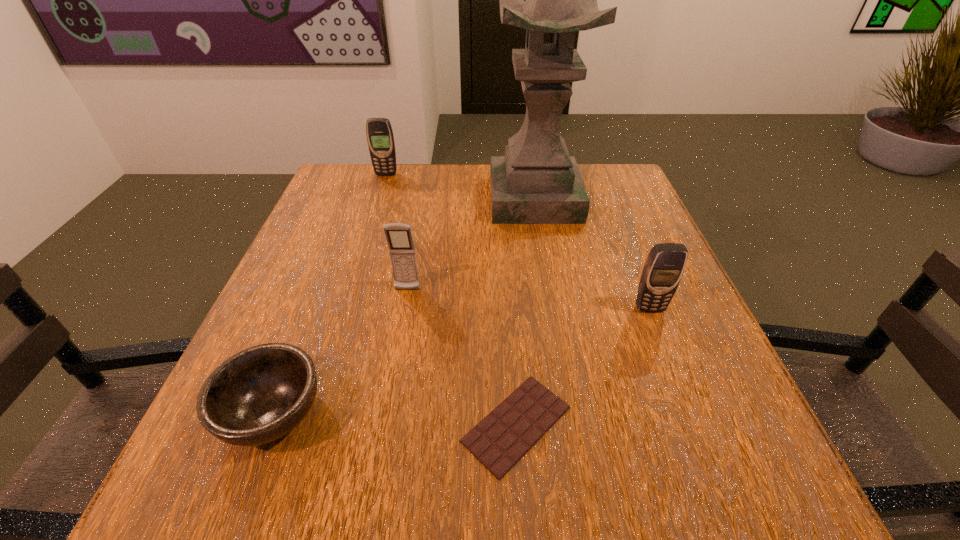
Where is `vacant area located at the front opening of the sculpture`? This screenshot has height=540, width=960. vacant area located at the front opening of the sculpture is located at coordinates coord(543,251).

Find the location of a particular element. The width and height of the screenshot is (960, 540). free space located on the front-facing side of the fourth nearest object is located at coordinates (396, 350).

Where is `vacant space located 0.390m on the screen of the leftmost cellular telephone`? This screenshot has width=960, height=540. vacant space located 0.390m on the screen of the leftmost cellular telephone is located at coordinates (356, 270).

Image resolution: width=960 pixels, height=540 pixels. What are the coordinates of `blank space located on the front face of the rightmost cellular telephone` in the screenshot? It's located at (694, 421).

Where is `free space located 0.220m on the back of the bowl`? free space located 0.220m on the back of the bowl is located at coordinates (324, 281).

Where is `free region located 0.360m on the back of the shortest object`? This screenshot has width=960, height=540. free region located 0.360m on the back of the shortest object is located at coordinates (504, 242).

At what (x,y) coordinates should I click in order to perform the action: click on sculpture that is at the far edge. Please return your answer as a coordinate pair (x, y). Looking at the image, I should click on (537, 182).

At what (x,y) coordinates should I click in order to perform the action: click on cellular telephone that is at the far edge. Please return your answer as a coordinate pair (x, y). Looking at the image, I should click on click(x=380, y=138).

Where is `bowl at the near edge`? The width and height of the screenshot is (960, 540). bowl at the near edge is located at coordinates (260, 394).

Find the location of `chocolate bar that is at the near edge`. chocolate bar that is at the near edge is located at coordinates (498, 441).